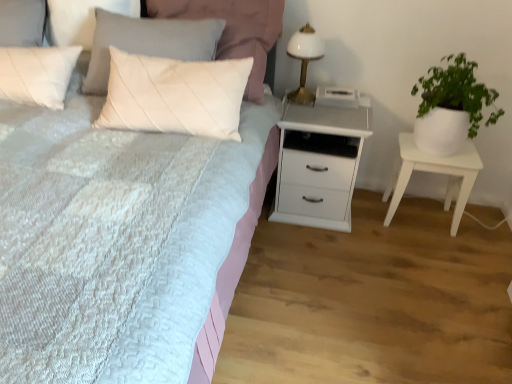
This screenshot has width=512, height=384. What do you see at coordinates (191, 261) in the screenshot? I see `white textured bed at center` at bounding box center [191, 261].

What do you see at coordinates (320, 163) in the screenshot? The image size is (512, 384). I see `white wood chest of drawers at center` at bounding box center [320, 163].

Find the location of a particular element. white quilted pillow at upper center is located at coordinates (233, 30).

The image size is (512, 384). I want to click on green leafy plant in white pot at right, so click(x=450, y=106).

Where is `white textured bed at center`? white textured bed at center is located at coordinates (191, 261).

Measure the distance from white quilted pillow at upper center to white matte nightstand at right.

The distance of white quilted pillow at upper center from white matte nightstand at right is 1.03 meters.

Is white quilted pillow at upper center not near white matte nightstand at right?

Yes, white quilted pillow at upper center is far from white matte nightstand at right.

From a real-world perspective, between white quilted pillow at upper center and white matte nightstand at right, who is vertically lower?

In real-world perspective, white matte nightstand at right is lower.

In the scene shown: Would you say white quilted pillow at upper center contains white matte nightstand at right?

No, white matte nightstand at right is not a part of white quilted pillow at upper center.

Does white glossy table lamp at upper right have a smaller size compared to green leafy plant in white pot at right?

Yes.

Looking at this image, do you think white glossy table lamp at upper right is within green leafy plant in white pot at right, or outside of it?

white glossy table lamp at upper right is located beyond the bounds of green leafy plant in white pot at right.

From a real-world perspective, between white glossy table lamp at upper right and green leafy plant in white pot at right, who is vertically higher?

From a 3D spatial view, white glossy table lamp at upper right is above.

Which is correct: white quilted pillow at upper center is inside white wood chest of drawers at center, or outside of it?

white quilted pillow at upper center is located beyond the bounds of white wood chest of drawers at center.

Between white quilted pillow at upper center and white wood chest of drawers at center, which one has smaller width?

With smaller width is white quilted pillow at upper center.

From the image's perspective, is white quilted pillow at upper center under white wood chest of drawers at center?

Actually, white quilted pillow at upper center appears above white wood chest of drawers at center in the image.

Can you confirm if white glossy table lamp at upper right is smaller than white quilted pillow at upper center?

Correct, white glossy table lamp at upper right occupies less space than white quilted pillow at upper center.

Are white glossy table lamp at upper right and white quilted pillow at upper center making contact?

They are not placed beside each other.

Does point (305, 78) appear closer or farther from the camera than point (239, 12)?

Point (305, 78) appears to be farther away from the viewer than point (239, 12).

Which of these two, white wood chest of drawers at center or white textured bed at center, stands taller?

white textured bed at center.

From a real-world perspective, is white wood chest of drawers at center located beneath white textured bed at center?

Correct, in the physical world, white wood chest of drawers at center is lower than white textured bed at center.

How many degrees apart are the facing directions of white wood chest of drawers at center and white textured bed at center?

1.8 degrees separate the facing orientations of white wood chest of drawers at center and white textured bed at center.

In the image, is white wood chest of drawers at center positioned in front of or behind white textured bed at center?

In the image, white wood chest of drawers at center appears behind white textured bed at center.

Considering the sizes of objects white textured bed at center and green leafy plant in white pot at right in the image provided, who is taller, white textured bed at center or green leafy plant in white pot at right?

white textured bed at center.

From a real-world perspective, which is physically below, white textured bed at center or green leafy plant in white pot at right?

white textured bed at center.

Is white textured bed at center to the left of green leafy plant in white pot at right from the viewer's perspective?

Yes, white textured bed at center is to the left of green leafy plant in white pot at right.

Does point (49, 194) come closer to viewer compared to point (441, 81)?

Yes, point (49, 194) is closer to viewer.

In terms of height, does green leafy plant in white pot at right look taller or shorter compared to white quilted pillow at upper center?

Clearly, green leafy plant in white pot at right is taller compared to white quilted pillow at upper center.

The image size is (512, 384). In order to click on pillow that appears above the green leafy plant in white pot at right (from a real-world perspective) in this screenshot , I will do `click(233, 30)`.

Does green leafy plant in white pot at right contain white quilted pillow at upper center?

Definitely not — white quilted pillow at upper center is not inside green leafy plant in white pot at right.

Considering the relative positions of green leafy plant in white pot at right and white quilted pillow at upper center in the image provided, is green leafy plant in white pot at right to the left of white quilted pillow at upper center from the viewer's perspective?

No, green leafy plant in white pot at right is not to the left of white quilted pillow at upper center.

The width and height of the screenshot is (512, 384). There is a white matte nightstand at right. Identify the location of pillow above it (from a real-world perspective). (233, 30).

Identify the location of houseplant located underneath the white glossy table lamp at upper right (from a real-world perspective). (450, 106).

Based on their spatial positions, is white matte nightstand at right or white glossy table lamp at upper right further from green leafy plant in white pot at right?

white glossy table lamp at upper right is positioned further to the anchor green leafy plant in white pot at right.

Estimate the real-world distances between objects in this image. Which object is closer to green leafy plant in white pot at right, white textured bed at center or white wood chest of drawers at center?

white wood chest of drawers at center is closer to green leafy plant in white pot at right.

When comparing their distances from white textured bed at center, does green leafy plant in white pot at right or white wood chest of drawers at center seem further?

green leafy plant in white pot at right is further to white textured bed at center.

From the image, which object appears to be nearer to white wood chest of drawers at center, green leafy plant in white pot at right or white quilted pillow at upper center?

green leafy plant in white pot at right lies closer to white wood chest of drawers at center than the other object.

From the image, which object appears to be farther from white matte nightstand at right, white textured bed at center or white wood chest of drawers at center?

white textured bed at center is further to white matte nightstand at right.

Considering their positions, is white wood chest of drawers at center positioned further to white textured bed at center than white quilted pillow at upper center?

white quilted pillow at upper center is positioned further to the anchor white textured bed at center.

Considering their positions, is white wood chest of drawers at center positioned closer to white matte nightstand at right than white textured bed at center?

The object closer to white matte nightstand at right is white wood chest of drawers at center.

Which object lies further to the anchor point white quilted pillow at upper center, green leafy plant in white pot at right or white matte nightstand at right?

The object further to white quilted pillow at upper center is white matte nightstand at right.

The width and height of the screenshot is (512, 384). In order to click on bedside lamp situated between white quilted pillow at upper center and green leafy plant in white pot at right from left to right in this screenshot , I will do `click(304, 60)`.

Locate an element on the screen. The height and width of the screenshot is (384, 512). bedside lamp between white textured bed at center and white matte nightstand at right in the front-back direction is located at coordinates (304, 60).

At what (x,y) coordinates should I click in order to perform the action: click on chest of drawers between white textured bed at center and white matte nightstand at right from front to back. Please return your answer as a coordinate pair (x, y). The image size is (512, 384). Looking at the image, I should click on (320, 163).

At what (x,y) coordinates should I click in order to perform the action: click on houseplant situated between white textured bed at center and white matte nightstand at right from left to right. Please return your answer as a coordinate pair (x, y). This screenshot has height=384, width=512. Looking at the image, I should click on (450, 106).